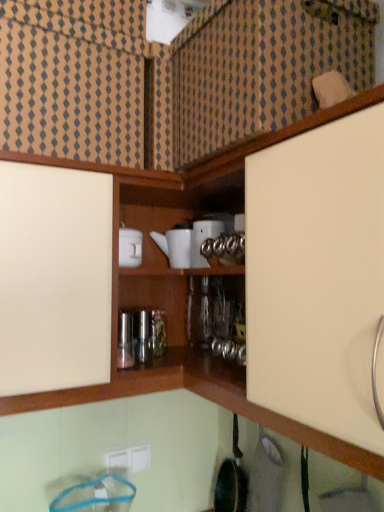
The image size is (384, 512). Identify the location of white glossy teapot at upper center, arranged as the second appliance when viewed from the left. (203, 239).

Measure the distance between white glossy teapot at upper center, the first appliance positioned from the right, and camera.

They are 3.88 feet apart.

In order to face white plastic electric outlet at lower center, should I rotate leftwards or rightwards?

A 8.097 degree turn to the left will do.

Locate an element on the screen. white ceramic teapot at center, the 2th appliance from the right is located at coordinates (175, 247).

Between white plastic electric outlet at lower center and white glossy teapot at upper center, the first appliance positioned from the right, which one has more height?

A: Standing taller between the two is white glossy teapot at upper center, the first appliance positioned from the right.

Would you say white glossy teapot at upper center, the first appliance positioned from the right, is part of white plastic electric outlet at lower center's contents?

That's incorrect, white glossy teapot at upper center, the first appliance positioned from the right, is not inside white plastic electric outlet at lower center.

Could you tell me if white plastic electric outlet at lower center is turned towards white glossy teapot at upper center, arranged as the second appliance when viewed from the left?

No.

Considering the relative positions of white plastic electric outlet at lower center and white glossy teapot at upper center, the first appliance positioned from the right, in the image provided, is white plastic electric outlet at lower center to the left of white glossy teapot at upper center, the first appliance positioned from the right, from the viewer's perspective?

Yes.

Is white ceramic teapot at center, the 2th appliance from the right, not within white plastic electric outlet at lower center?

white ceramic teapot at center, the 2th appliance from the right, is positioned outside white plastic electric outlet at lower center.

Is the position of white ceramic teapot at center, placed as the 1th appliance when sorted from left to right, more distant than that of white plastic electric outlet at lower center?

No, white ceramic teapot at center, placed as the 1th appliance when sorted from left to right, is closer to the camera.

From the picture: Which of these two, white ceramic teapot at center, the 2th appliance from the right, or white plastic electric outlet at lower center, is thinner?

With smaller width is white plastic electric outlet at lower center.

From a real-world perspective, is white ceramic teapot at center, the 2th appliance from the right, under white plastic electric outlet at lower center?

No.

Is white glossy teapot at upper center, arranged as the second appliance when viewed from the left, in contact with white plastic electric outlet at lower center?

No.

Which object is wider, white glossy teapot at upper center, the first appliance positioned from the right, or white plastic electric outlet at lower center?

white glossy teapot at upper center, the first appliance positioned from the right.

Could you measure the distance between white glossy teapot at upper center, arranged as the second appliance when viewed from the left, and white plastic electric outlet at lower center?

A distance of 26.38 inches exists between white glossy teapot at upper center, arranged as the second appliance when viewed from the left, and white plastic electric outlet at lower center.

In the scene shown: Which point is more distant from viewer, (194,238) or (139,466)?

The point (139,466) is farther from the camera.

Is white glossy teapot at upper center, arranged as the second appliance when viewed from the left, bigger than white ceramic teapot at center, the 2th appliance from the right?

No.

From a real-world perspective, is white glossy teapot at upper center, the first appliance positioned from the right, on top of white ceramic teapot at center, placed as the 1th appliance when sorted from left to right?

A: Yes, from a real-world perspective, white glossy teapot at upper center, the first appliance positioned from the right, is over white ceramic teapot at center, placed as the 1th appliance when sorted from left to right

From the image's perspective, is white glossy teapot at upper center, arranged as the second appliance when viewed from the left, on white ceramic teapot at center, placed as the 1th appliance when sorted from left to right?

Yes, from the image's perspective, white glossy teapot at upper center, arranged as the second appliance when viewed from the left, is on top of white ceramic teapot at center, placed as the 1th appliance when sorted from left to right.

Is white glossy teapot at upper center, the first appliance positioned from the right, aimed at white ceramic teapot at center, placed as the 1th appliance when sorted from left to right?

No, white glossy teapot at upper center, the first appliance positioned from the right, is not oriented towards white ceramic teapot at center, placed as the 1th appliance when sorted from left to right.

Could you measure the distance between white ceramic teapot at center, the 2th appliance from the right, and white glossy teapot at upper center, arranged as the second appliance when viewed from the left?

white ceramic teapot at center, the 2th appliance from the right, is 2.68 inches away from white glossy teapot at upper center, arranged as the second appliance when viewed from the left.

Which object is positioned more to the left, white ceramic teapot at center, placed as the 1th appliance when sorted from left to right, or white glossy teapot at upper center, arranged as the second appliance when viewed from the left?

From the viewer's perspective, white ceramic teapot at center, placed as the 1th appliance when sorted from left to right, appears more on the left side.

In the scene shown: Between white ceramic teapot at center, placed as the 1th appliance when sorted from left to right, and white glossy teapot at upper center, the first appliance positioned from the right, which one has larger size?

white ceramic teapot at center, placed as the 1th appliance when sorted from left to right, is bigger.

Considering the points (151, 234) and (197, 242), which point is in front, point (151, 234) or point (197, 242)?

Point (197, 242)

Identify the location of electric outlet below the white ceramic teapot at center, the 2th appliance from the right (from the image's perspective). (130, 458).

From a real-world perspective, who is located lower, white plastic electric outlet at lower center or white ceramic teapot at center, placed as the 1th appliance when sorted from left to right?

In real-world perspective, white plastic electric outlet at lower center is lower.

Considering the sizes of white plastic electric outlet at lower center and white ceramic teapot at center, the 2th appliance from the right, in the image, is white plastic electric outlet at lower center wider or thinner than white ceramic teapot at center, the 2th appliance from the right,?

Clearly, white plastic electric outlet at lower center has less width compared to white ceramic teapot at center, the 2th appliance from the right.

In order to click on the 2nd appliance counting from the right side of the white plastic electric outlet at lower center in this screenshot , I will do `click(203, 239)`.

Identify the location of the 1st appliance above the white plastic electric outlet at lower center (from a real-world perspective). (175, 247).

When comparing their distances from white ceramic teapot at center, placed as the 1th appliance when sorted from left to right, does white glossy teapot at upper center, arranged as the second appliance when viewed from the left, or white plastic electric outlet at lower center seem further?

white plastic electric outlet at lower center.

Looking at the image, which one is located closer to white glossy teapot at upper center, arranged as the second appliance when viewed from the left, white ceramic teapot at center, placed as the 1th appliance when sorted from left to right, or white plastic electric outlet at lower center?

white ceramic teapot at center, placed as the 1th appliance when sorted from left to right, is positioned closer to the anchor white glossy teapot at upper center, arranged as the second appliance when viewed from the left.

Looking at the image, which one is located further to white plastic electric outlet at lower center, white glossy teapot at upper center, arranged as the second appliance when viewed from the left, or white ceramic teapot at center, placed as the 1th appliance when sorted from left to right?

The object further to white plastic electric outlet at lower center is white glossy teapot at upper center, arranged as the second appliance when viewed from the left.

From the image, which object appears to be farther from white ceramic teapot at center, the 2th appliance from the right, white plastic electric outlet at lower center or white glossy teapot at upper center, arranged as the second appliance when viewed from the left?

white plastic electric outlet at lower center lies further to white ceramic teapot at center, the 2th appliance from the right, than the other object.

Which object lies further to the anchor point white plastic electric outlet at lower center, white ceramic teapot at center, the 2th appliance from the right, or white glossy teapot at upper center, the first appliance positioned from the right?

white glossy teapot at upper center, the first appliance positioned from the right.

When comparing their distances from white glossy teapot at upper center, arranged as the second appliance when viewed from the left, does white plastic electric outlet at lower center or white ceramic teapot at center, placed as the 1th appliance when sorted from left to right, seem further?

Based on the image, white plastic electric outlet at lower center appears to be further to white glossy teapot at upper center, arranged as the second appliance when viewed from the left.

At what (x,y) coordinates should I click in order to perform the action: click on appliance that lies between white glossy teapot at upper center, the first appliance positioned from the right, and white plastic electric outlet at lower center from top to bottom. Please return your answer as a coordinate pair (x, y). Looking at the image, I should click on (175, 247).